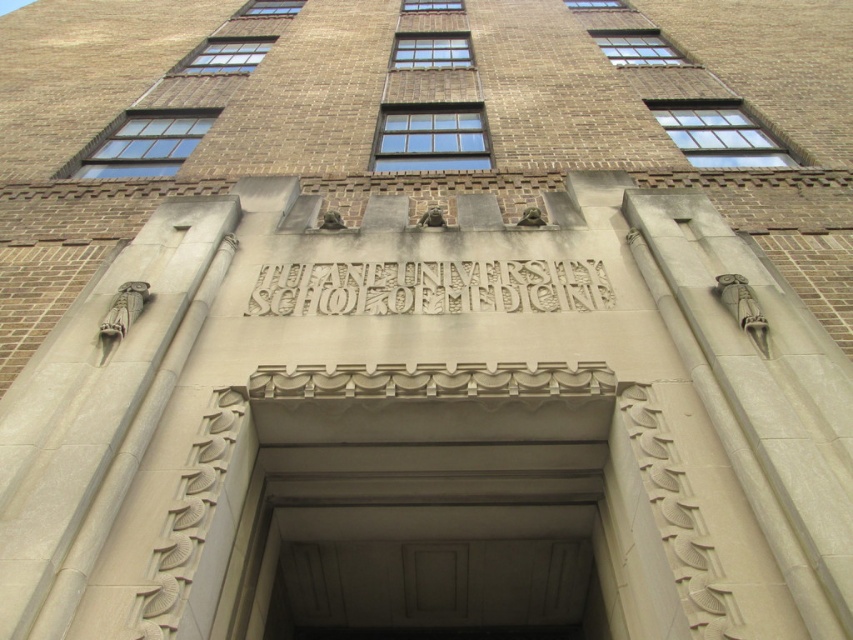
Question: Is beige stone sign at center wider than carved stone text at center?

Choices:
 (A) no
 (B) yes

Answer: (A)

Question: Which point is farther from the camera taking this photo?

Choices:
 (A) (521, 296)
 (B) (686, 417)

Answer: (A)

Question: Is beige stone sign at center smaller than carved stone text at center?

Choices:
 (A) yes
 (B) no

Answer: (A)

Question: Does beige stone sign at center have a greater width compared to carved stone text at center?

Choices:
 (A) no
 (B) yes

Answer: (A)

Question: Among these objects, which one is farthest from the camera?

Choices:
 (A) carved stone text at center
 (B) beige stone sign at center

Answer: (B)

Question: Which object is farther from the camera taking this photo?

Choices:
 (A) carved stone text at center
 (B) beige stone sign at center

Answer: (B)